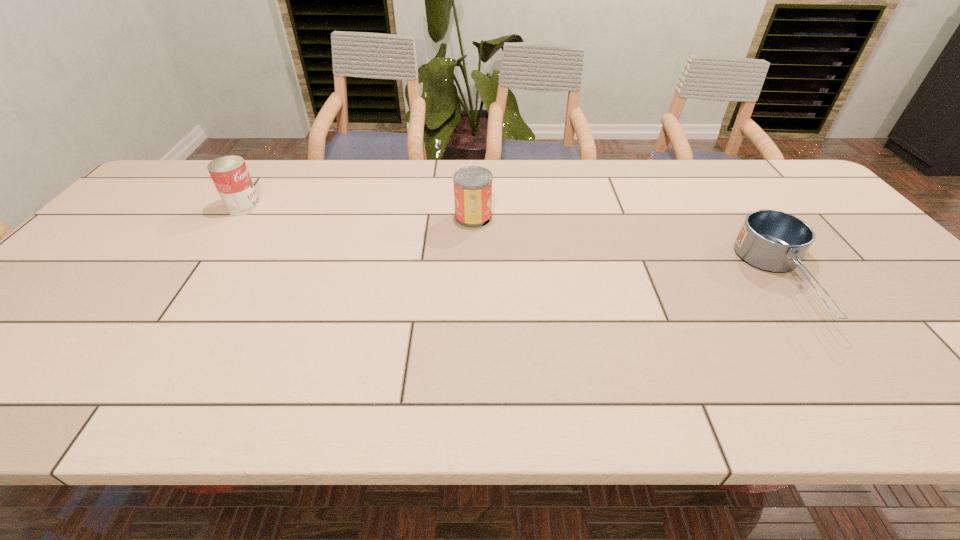
Image resolution: width=960 pixels, height=540 pixels. I want to click on free spot between the leftmost object and the shortest object, so click(x=514, y=245).

Find the location of `free space between the left can and the right can`. free space between the left can and the right can is located at coordinates (358, 212).

At what (x,y) coordinates should I click in order to perform the action: click on vacant space in between the saucepan and the right can. Please return your answer as a coordinate pair (x, y). Looking at the image, I should click on (629, 249).

The width and height of the screenshot is (960, 540). In order to click on object that is the closest to the left can in this screenshot , I will do `click(472, 185)`.

This screenshot has height=540, width=960. Identify the location of the second closest object to the leftmost object. (774, 241).

At what (x,y) coordinates should I click in order to perform the action: click on vacant point that satisfies the following two spatial constraints: 1. on the front label of the left can; 2. on the back side of the second object from right to left. Please return your answer as a coordinate pair (x, y). The image size is (960, 540). Looking at the image, I should click on (237, 217).

This screenshot has width=960, height=540. What are the coordinates of `blank space that satisfies the following two spatial constraints: 1. on the front label of the second object from right to left; 2. on the right side of the left can` in the screenshot? It's located at (237, 217).

This screenshot has height=540, width=960. I want to click on free spot that satisfies the following two spatial constraints: 1. on the back side of the second object from right to left; 2. on the front label of the leftmost object, so click(x=473, y=207).

Identify the location of vacant space that satisfies the following two spatial constraints: 1. on the front label of the second object from left to right; 2. on the left side of the left can. The width and height of the screenshot is (960, 540). (237, 217).

Find the location of a particular element. The height and width of the screenshot is (540, 960). free space in the image that satisfies the following two spatial constraints: 1. on the front label of the leftmost object; 2. on the left side of the right can is located at coordinates (237, 217).